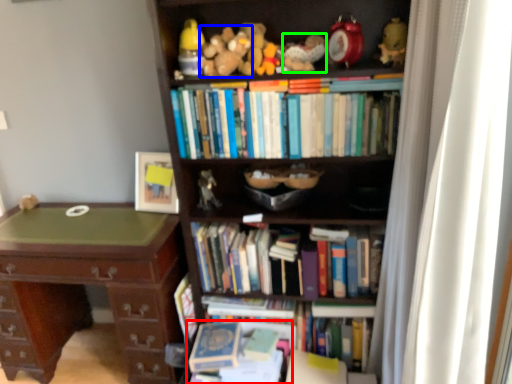
Question: Based on their relative distances, which object is nearer to book (highlighted by a red box)? Choose from toy (highlighted by a blue box) and toy (highlighted by a green box).

Choices:
 (A) toy
 (B) toy

Answer: (A)